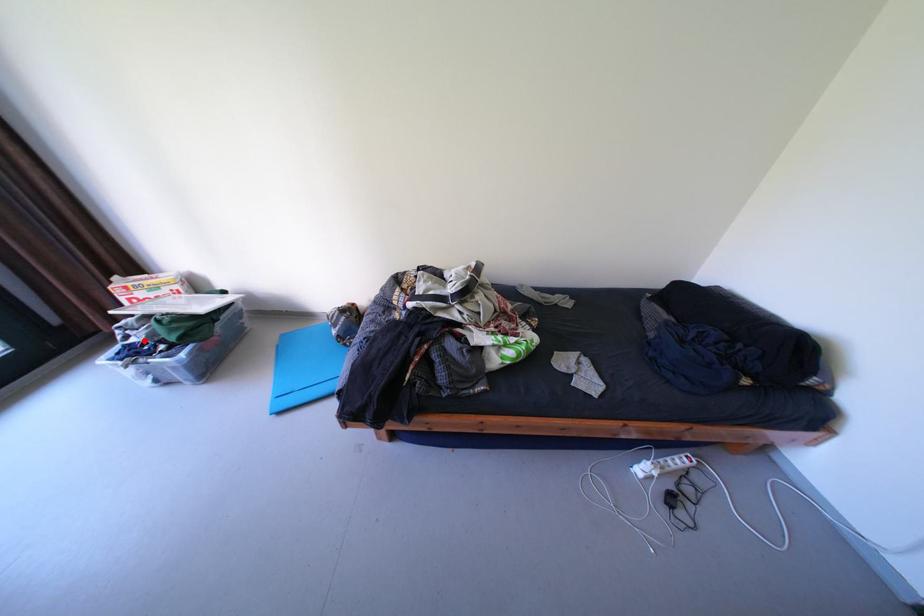
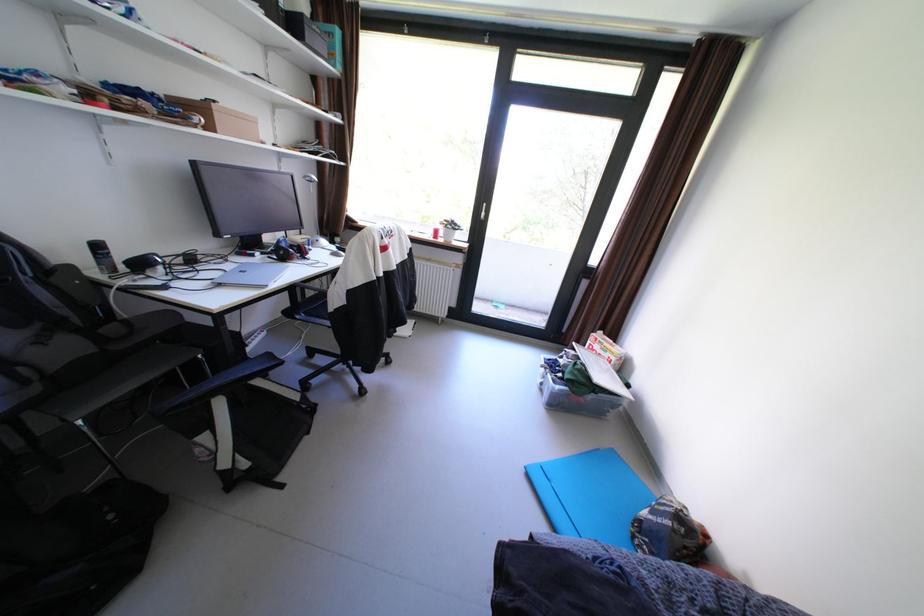
Locate, in the second image, the point that corresponds to the highlighted location in the first image.

(572, 361)